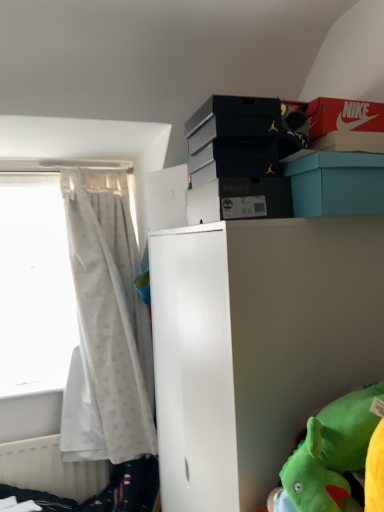
The height and width of the screenshot is (512, 384). Describe the element at coordinates (106, 326) in the screenshot. I see `white sheer curtain at left` at that location.

Measure the distance between point (x=321, y=201) and camera.

1.01 meters.

You are a GUI agent. You are given a task and a screenshot of the screen. Output one action in this format:
    pyautogui.click(x=<x>, y=<y>)
    Task: Click on the white plastic radiator at lower left
    
    Given the screenshot: What is the action you would take?
    pyautogui.click(x=50, y=469)

How much space does black matte shoebox at upper center, which appears as the 5th storage box when viewed from the top, occupy vertically?

4.32 inches.

Measure the distance between white sheer curtain at left and camera.

white sheer curtain at left is 7.04 feet from camera.

Where is `white sheer curtain at left`? The image size is (384, 512). white sheer curtain at left is located at coordinates (106, 326).

Does black matte shoebox at upper center, arranged as the 3th storage box when viewed from the top, have a lesser height compared to white sheer curtain at left?

Indeed, black matte shoebox at upper center, arranged as the 3th storage box when viewed from the top, has a lesser height compared to white sheer curtain at left.

Looking at this image, is black matte shoebox at upper center, arranged as the 3th storage box when viewed from the top, positioned behind white sheer curtain at left?

That is False.

How many degrees apart are the facing directions of black matte shoebox at upper center, arranged as the 3th storage box when viewed from the top, and white sheer curtain at left?

The angular difference between black matte shoebox at upper center, arranged as the 3th storage box when viewed from the top, and white sheer curtain at left is 92.2 degrees.

From the picture: Are red matte shoebox at upper right, which is the 1th storage box in top-to-bottom order, and white sheer curtain at left located far from each other?

Absolutely, red matte shoebox at upper right, which is the 1th storage box in top-to-bottom order, is distant from white sheer curtain at left.

Is red matte shoebox at upper right, which is the fifth storage box in bottom-to-top order, spatially inside white sheer curtain at left, or outside of it?

red matte shoebox at upper right, which is the fifth storage box in bottom-to-top order, cannot be found inside white sheer curtain at left.

Is red matte shoebox at upper right, which is the fifth storage box in bottom-to-top order, thinner than white sheer curtain at left?

Indeed, red matte shoebox at upper right, which is the fifth storage box in bottom-to-top order, has a lesser width compared to white sheer curtain at left.

Which of these two, white sheer curtain at left or white matte cabinet at center, is wider?

white matte cabinet at center is wider.

Does white sheer curtain at left lie behind white matte cabinet at center?

Yes, white sheer curtain at left is further from the viewer.

Based on the photo, from a real-world perspective, is white sheer curtain at left on white matte cabinet at center?

Yes, from a real-world perspective, white sheer curtain at left is above white matte cabinet at center.

Considering the sizes of objects white sheer curtain at left and white matte cabinet at center in the image provided, who is shorter, white sheer curtain at left or white matte cabinet at center?

white sheer curtain at left.

In the image, is black matte shoebox at upper center, which appears as the third storage box when ordered from the bottom, positioned in front of or behind white glossy bed frame at lower left?

black matte shoebox at upper center, which appears as the third storage box when ordered from the bottom, is in front of white glossy bed frame at lower left.

Does black matte shoebox at upper center, which appears as the third storage box when ordered from the bottom, have a smaller size compared to white glossy bed frame at lower left?

Indeed, black matte shoebox at upper center, which appears as the third storage box when ordered from the bottom, has a smaller size compared to white glossy bed frame at lower left.

How many degrees apart are the facing directions of black matte shoebox at upper center, arranged as the 3th storage box when viewed from the top, and white glossy bed frame at lower left?

There is a 91.5-degree angle between the facing directions of black matte shoebox at upper center, arranged as the 3th storage box when viewed from the top, and white glossy bed frame at lower left.

Which object is positioned more to the right, black matte shoebox at upper center, arranged as the 3th storage box when viewed from the top, or white glossy bed frame at lower left?

Positioned to the right is black matte shoebox at upper center, arranged as the 3th storage box when viewed from the top.

Considering the relative positions of white sheer curtain at left and white glossy bed frame at lower left in the image provided, is white sheer curtain at left to the left of white glossy bed frame at lower left from the viewer's perspective?

Yes, white sheer curtain at left is to the left of white glossy bed frame at lower left.

Is white sheer curtain at left behind white glossy bed frame at lower left?

Yes.

Find the location of `window that appears above the white glossy bed frame at lower left (from the image's perspective)`. window that appears above the white glossy bed frame at lower left (from the image's perspective) is located at coordinates (34, 286).

Is white glossy bed frame at lower left completely or partially inside white matte cabinet at center?

No, white glossy bed frame at lower left is not a part of white matte cabinet at center.

Consider the image. Considering the sizes of white matte cabinet at center and white glossy bed frame at lower left in the image, is white matte cabinet at center wider or thinner than white glossy bed frame at lower left?

Considering their sizes, white matte cabinet at center looks broader than white glossy bed frame at lower left.

Is white matte cabinet at center at the left side of white glossy bed frame at lower left?

No, white matte cabinet at center is not to the left of white glossy bed frame at lower left.

From a real-world perspective, who is located higher, white matte cabinet at center or white glossy bed frame at lower left?

In real-world perspective, white matte cabinet at center is above.

Which object is further away from the camera taking this photo, white sheer curtain at left or white sheer curtain at left?

white sheer curtain at left is further away from the camera.

Which object is positioned more to the left, white sheer curtain at left or white sheer curtain at left?

white sheer curtain at left.

Would you say white sheer curtain at left is inside or outside white sheer curtain at left?

white sheer curtain at left lies outside white sheer curtain at left.

In the image, there is a white sheer curtain at left. At what (x,y) coordinates should I click in order to perform the action: click on curtain below it (from a real-world perspective). Please return your answer as a coordinate pair (x, y). This screenshot has height=512, width=384. Looking at the image, I should click on (106, 326).

There is a white sheer curtain at left. Find the location of `the 3rd storage box above it (from the image's perspective)`. the 3rd storage box above it (from the image's perspective) is located at coordinates (239, 159).

You are a GUI agent. You are given a task and a screenshot of the screen. Output one action in this format:
    pyautogui.click(x=<x>, y=<y>)
    Task: Click on the curtain on the left of red matte shoebox at upper right, which is the fifth storage box in bottom-to-top order
    The height and width of the screenshot is (512, 384).
    Given the screenshot: What is the action you would take?
    pyautogui.click(x=106, y=326)

When comparing their distances from white plastic radiator at lower left, does white sheer curtain at left or white glossy bed frame at lower left seem further?

Among the two, white sheer curtain at left is located further to white plastic radiator at lower left.

Estimate the real-world distances between objects in this image. Which object is closer to white sheer curtain at left, white matte cabinet at center or red matte shoebox at upper right, which is the 1th storage box in top-to-bottom order?

Among the two, white matte cabinet at center is located nearer to white sheer curtain at left.

Looking at the image, which one is located closer to white matte cabinet at center, red matte shoebox at upper right, which is the fifth storage box in bottom-to-top order, or white glossy bed frame at lower left?

red matte shoebox at upper right, which is the fifth storage box in bottom-to-top order.

Consider the image. From the image, which object appears to be nearer to white sheer curtain at left, white sheer curtain at left or black matte shoebox at upper center, which is the second storage box from top to bottom?

Among the two, white sheer curtain at left is located nearer to white sheer curtain at left.

Based on the photo, from the image, which object appears to be farther from white sheer curtain at left, black matte shoebox at upper center, which appears as the 5th storage box when viewed from the top, or white matte cabinet at center?

The object further to white sheer curtain at left is black matte shoebox at upper center, which appears as the 5th storage box when viewed from the top.

Estimate the real-world distances between objects in this image. Which object is further from black matte shoebox at upper center, arranged as the 3th storage box when viewed from the top, white sheer curtain at left or red matte shoebox at upper right, which is the fifth storage box in bottom-to-top order?

white sheer curtain at left is positioned further to the anchor black matte shoebox at upper center, arranged as the 3th storage box when viewed from the top.

Which object lies further to the anchor point black matte shoebox at upper center, which appears as the 5th storage box when viewed from the top, white sheer curtain at left or white plastic radiator at lower left?

white plastic radiator at lower left is positioned further to the anchor black matte shoebox at upper center, which appears as the 5th storage box when viewed from the top.

In the scene shown: Looking at the image, which one is located further to red matte shoebox at upper right, which is the fifth storage box in bottom-to-top order, white matte cabinet at center or black matte shoebox at upper center, arranged as the 3th storage box when viewed from the top?

Based on the image, white matte cabinet at center appears to be further to red matte shoebox at upper right, which is the fifth storage box in bottom-to-top order.

I want to click on cabinetry between teal cardboard box at upper center, which appears as the second storage box when ordered from the bottom, and white sheer curtain at left in the front-back direction, so click(257, 345).

Where is `cabinetry between teal cardboard box at upper center, the fourth storage box viewed from the top, and white plastic radiator at lower left in the up-down direction`? cabinetry between teal cardboard box at upper center, the fourth storage box viewed from the top, and white plastic radiator at lower left in the up-down direction is located at coordinates (257, 345).

The width and height of the screenshot is (384, 512). I want to click on cabinetry between black matte shoebox at upper center, acting as the 1th storage box starting from the bottom, and white plastic radiator at lower left in the up-down direction, so (x=257, y=345).

You are a GUI agent. You are given a task and a screenshot of the screen. Output one action in this format:
    pyautogui.click(x=<x>, y=<y>)
    Task: Click on the window between red matte shoebox at upper right, which is the 1th storage box in top-to-bottom order, and white glossy bed frame at lower left, in the vertical direction
    The image size is (384, 512).
    Given the screenshot: What is the action you would take?
    pyautogui.click(x=34, y=286)